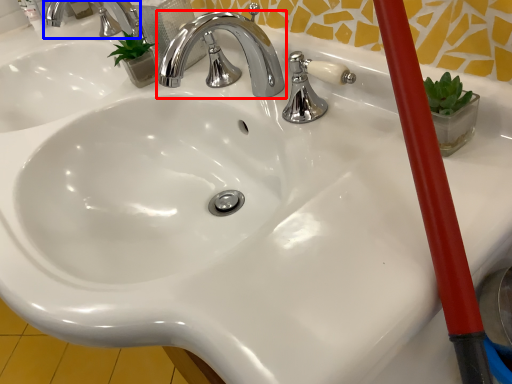
Question: Which of the following is the farthest to the observer, tap (highlighted by a red box) or tap (highlighted by a blue box)?

Choices:
 (A) tap
 (B) tap

Answer: (B)